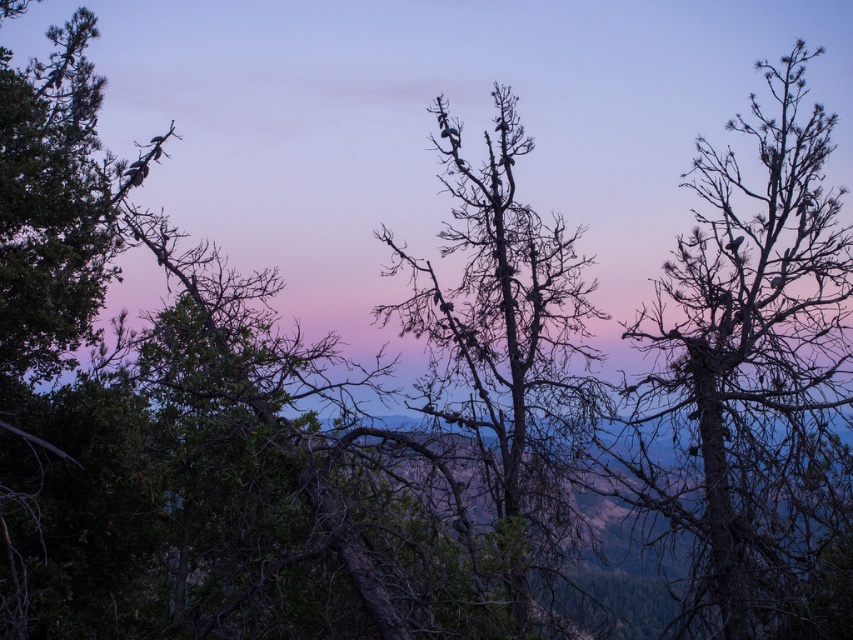
In the scene described, there is a point marked at coordinates (753, 385). Based on the image, what object does this point most likely correspond to?

The point at coordinates (753, 385) corresponds to the dark brown bark tree at right.